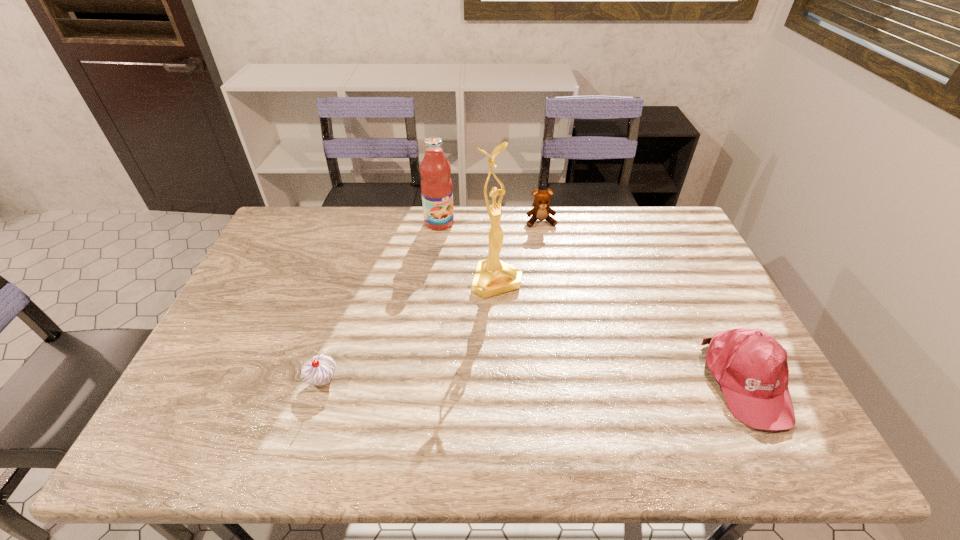
This screenshot has height=540, width=960. Find the location of `vacant area between the teddy bear and the third object from right to left`. vacant area between the teddy bear and the third object from right to left is located at coordinates (519, 251).

This screenshot has width=960, height=540. I want to click on blank region between the rightmost object and the fourth object from right to left, so click(593, 302).

Where is `vacant point located between the leftmost object and the tallest object`? The height and width of the screenshot is (540, 960). vacant point located between the leftmost object and the tallest object is located at coordinates (410, 330).

Where is `free space between the baseball cap and the cupcake`? free space between the baseball cap and the cupcake is located at coordinates (536, 381).

At what (x,y) coordinates should I click in order to perform the action: click on empty location between the cupcake and the third nearest object. Please return your answer as a coordinate pair (x, y). Looking at the image, I should click on (410, 330).

Where is `vacant area that lies between the award and the cupcake`? Image resolution: width=960 pixels, height=540 pixels. vacant area that lies between the award and the cupcake is located at coordinates (410, 330).

The height and width of the screenshot is (540, 960). In order to click on blank region between the second tallest object and the cupcake in this screenshot , I will do click(381, 302).

Locate an element on the screen. The image size is (960, 540). vacant area that lies between the tallest object and the rightmost object is located at coordinates (622, 331).

Find the location of a particular element. empty space between the fourth object from left to right and the baseball cap is located at coordinates (644, 302).

I want to click on object that is the fourth closest to the teddy bear, so click(318, 371).